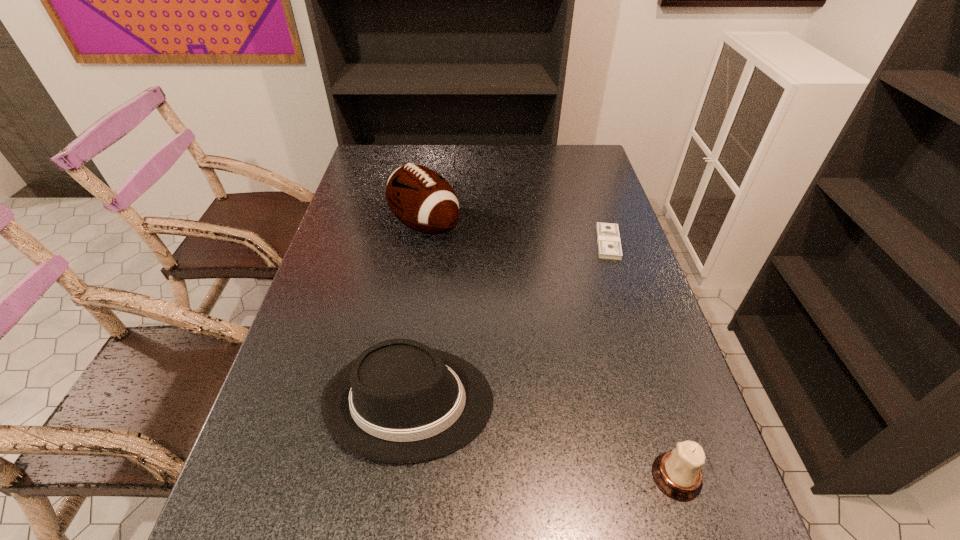
The height and width of the screenshot is (540, 960). I want to click on free space between the candle holder and the fedora, so click(543, 438).

Where is `free space that is in between the football (American) and the fedora`? The image size is (960, 540). free space that is in between the football (American) and the fedora is located at coordinates (417, 313).

This screenshot has height=540, width=960. What are the coordinates of `vacant space in between the fedora and the candle holder` in the screenshot? It's located at (543, 438).

The height and width of the screenshot is (540, 960). Identify the location of free spot between the tallest object and the fedora. (417, 313).

This screenshot has height=540, width=960. Identify the location of free space between the candle holder and the shortest object. (642, 359).

Where is `free point between the football (American) and the candle holder`? The height and width of the screenshot is (540, 960). free point between the football (American) and the candle holder is located at coordinates (551, 351).

Locate which object ranks in proximity to the shortest object. Please provide its 2D coordinates. Your answer should be formatted as a tuple, i.e. [(x, y)], where the tuple contains the x and y coordinates of a point satisfying the conditions above.

[(420, 198)]

Find the location of a particular element. the second closest object to the second shortest object is located at coordinates (609, 245).

Where is `free space that satisfies the following two spatial constraints: 1. on the front side of the dollar; 2. on the right side of the tallest object`? This screenshot has height=540, width=960. free space that satisfies the following two spatial constraints: 1. on the front side of the dollar; 2. on the right side of the tallest object is located at coordinates (422, 242).

Image resolution: width=960 pixels, height=540 pixels. What are the coordinates of `vacant region that satisfies the following two spatial constraints: 1. on the front-facing side of the fedora; 2. on the right side of the second shortest object` in the screenshot? It's located at (399, 476).